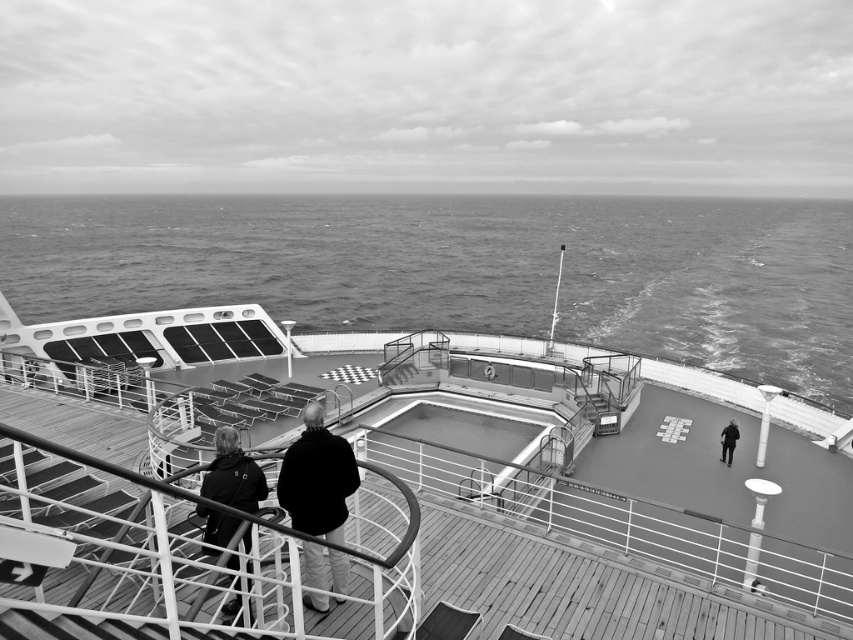
Find the location of a particular element. wooden deck at center is located at coordinates (390, 467).

Does wooden deck at center have a lesser width compared to dark wool coat at center?

No, wooden deck at center is not thinner than dark wool coat at center.

Is point (164, 609) in front of point (300, 522)?

Yes, point (164, 609) is closer to viewer.

Identify the location of wooden deck at center. Image resolution: width=853 pixels, height=640 pixels. (390, 467).

Is dark gray water at center closer to camera compared to dark gray fabric jacket at center right?

No, it is behind dark gray fabric jacket at center right.

Between dark gray water at center and dark gray fabric jacket at center right, which one appears on the right side from the viewer's perspective?

From the viewer's perspective, dark gray fabric jacket at center right appears more on the right side.

Measure the distance between point (540, 323) and camera.

139.80 feet

Identify the location of dark gray water at center. (467, 269).

Does wooden deck at center have a greater height compared to dark gray fabric jacket at lower left?

Yes, wooden deck at center is taller than dark gray fabric jacket at lower left.

Is wooden deck at center to the left of dark gray fabric jacket at lower left from the viewer's perspective?

No, wooden deck at center is not to the left of dark gray fabric jacket at lower left.

Describe the element at coordinates (390, 467) in the screenshot. I see `wooden deck at center` at that location.

Image resolution: width=853 pixels, height=640 pixels. Identify the location of wooden deck at center. (390, 467).